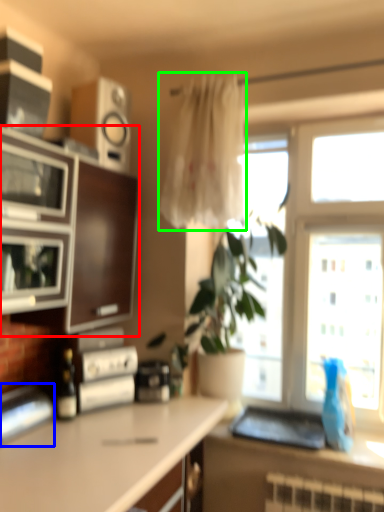
Question: Based on their relative distances, which object is nearer to cabinetry (highlighted by a red box)? Choose from appliance (highlighted by a blue box) and curtain (highlighted by a green box).

Choices:
 (A) appliance
 (B) curtain

Answer: (B)